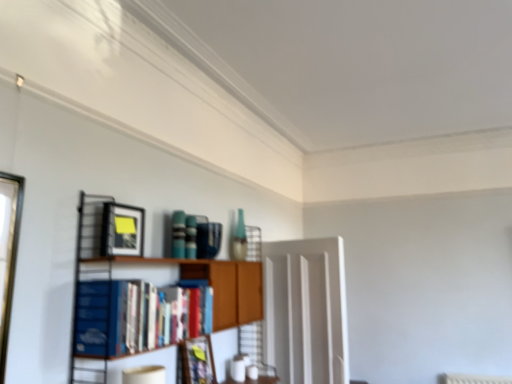
What do you see at coordinates (137, 316) in the screenshot? This screenshot has width=512, height=384. I see `blue hardcover book at left` at bounding box center [137, 316].

Where is `blue hardcover book at left`? The image size is (512, 384). blue hardcover book at left is located at coordinates (137, 316).

Locate an element on the screen. The height and width of the screenshot is (384, 512). wooden bookshelf at center is located at coordinates (148, 299).

Measure the distance between transparent glass door at center and camera.

transparent glass door at center and camera are 2.94 meters apart.

This screenshot has height=384, width=512. Identify the location of blue hardcover book at left. (137, 316).

Which of these two, matte black picture frame at upper left, positioned as the 1th picture frame in left-to-right order, or blue hardcover book at left, stands taller?

With more height is blue hardcover book at left.

Is matte black picture frame at upper left, which is the 2th picture frame from right to left, situated inside blue hardcover book at left or outside?

matte black picture frame at upper left, which is the 2th picture frame from right to left, is not enclosed by blue hardcover book at left.

From the image's perspective, which is above, matte black picture frame at upper left, which is the 2th picture frame from right to left, or blue hardcover book at left?

matte black picture frame at upper left, which is the 2th picture frame from right to left.

Which of these two, matte black picture frame at upper left, marked as the 2th picture frame in a bottom-to-top arrangement, or blue hardcover book at left, is wider?

With larger width is blue hardcover book at left.

Is transparent glass door at center turned away from wooden bookshelf at center?

Yes, transparent glass door at center's orientation is away from wooden bookshelf at center.

Between transparent glass door at center and wooden bookshelf at center, which one is positioned behind?

transparent glass door at center is further from the camera.

Does transparent glass door at center appear on the left side of wooden bookshelf at center?

No.

Between transparent glass door at center and wooden bookshelf at center, which one has larger width?

With larger width is wooden bookshelf at center.

Is blue hardcover book at left wider or thinner than matte black picture frame at center, the first picture frame ordered from the bottom?

In the image, blue hardcover book at left appears to be wider than matte black picture frame at center, the first picture frame ordered from the bottom.

From the picture: Considering the positions of objects blue hardcover book at left and matte black picture frame at center, marked as the first picture frame in a back-to-front arrangement, in the image provided, who is behind, blue hardcover book at left or matte black picture frame at center, marked as the first picture frame in a back-to-front arrangement,?

matte black picture frame at center, marked as the first picture frame in a back-to-front arrangement, is further away from the camera.

Which is more to the left, blue hardcover book at left or matte black picture frame at center, marked as the first picture frame in a back-to-front arrangement?

blue hardcover book at left.

Where is `the 2nd picture frame behind the blue hardcover book at left`? This screenshot has width=512, height=384. the 2nd picture frame behind the blue hardcover book at left is located at coordinates (197, 361).

Is matte black picture frame at center, marked as the first picture frame in a back-to-front arrangement, next to transparent glass door at center?

They are not placed beside each other.

Is matte black picture frame at center, acting as the 2th picture frame starting from the front, positioned with its back to transparent glass door at center?

matte black picture frame at center, acting as the 2th picture frame starting from the front, is not turned away from transparent glass door at center.

Is matte black picture frame at center, marked as the first picture frame in a right-to-left arrangement, inside the boundaries of transparent glass door at center, or outside?

matte black picture frame at center, marked as the first picture frame in a right-to-left arrangement, is outside transparent glass door at center.

Considering the sizes of objects matte black picture frame at center, which appears as the second picture frame when viewed from the top, and transparent glass door at center in the image provided, who is shorter, matte black picture frame at center, which appears as the second picture frame when viewed from the top, or transparent glass door at center?

matte black picture frame at center, which appears as the second picture frame when viewed from the top, is shorter.

Which is more to the left, wooden bookshelf at center or blue hardcover book at left?

blue hardcover book at left is more to the left.

Is wooden bookshelf at center spatially inside blue hardcover book at left, or outside of it?

wooden bookshelf at center is located beyond the bounds of blue hardcover book at left.

Can you confirm if wooden bookshelf at center is wider than blue hardcover book at left?

Correct, the width of wooden bookshelf at center exceeds that of blue hardcover book at left.

Does wooden bookshelf at center lie in front of blue hardcover book at left?

Yes, wooden bookshelf at center is in front of blue hardcover book at left.

Is point (83, 225) closer or farther from the camera than point (198, 359)?

Point (83, 225) is positioned closer to the camera compared to point (198, 359).

Can you confirm if wooden bookshelf at center is bigger than matte black picture frame at center, acting as the 2th picture frame starting from the front?

Yes, wooden bookshelf at center is bigger than matte black picture frame at center, acting as the 2th picture frame starting from the front.

Locate an element on the screen. shelf located above the matte black picture frame at center, acting as the 2th picture frame starting from the front (from the image's perspective) is located at coordinates (148, 299).

Is matte black picture frame at center, marked as the first picture frame in a right-to-left arrangement, located within wooden bookshelf at center?

Yes, matte black picture frame at center, marked as the first picture frame in a right-to-left arrangement, is a part of wooden bookshelf at center.

Is matte black picture frame at upper left, the 1th picture frame when ordered from front to back, aimed at matte black picture frame at center, marked as the first picture frame in a right-to-left arrangement?

No, matte black picture frame at upper left, the 1th picture frame when ordered from front to back, is not oriented towards matte black picture frame at center, marked as the first picture frame in a right-to-left arrangement.

Considering the sizes of matte black picture frame at upper left, the 1th picture frame when ordered from front to back, and matte black picture frame at center, marked as the first picture frame in a back-to-front arrangement, in the image, is matte black picture frame at upper left, the 1th picture frame when ordered from front to back, bigger or smaller than matte black picture frame at center, marked as the first picture frame in a back-to-front arrangement,?

Considering their sizes, matte black picture frame at upper left, the 1th picture frame when ordered from front to back, takes up less space than matte black picture frame at center, marked as the first picture frame in a back-to-front arrangement.

From a real-world perspective, which is physically below, matte black picture frame at upper left, which appears as the 2th picture frame when viewed from the back, or matte black picture frame at center, marked as the first picture frame in a back-to-front arrangement?

In real-world perspective, matte black picture frame at center, marked as the first picture frame in a back-to-front arrangement, is lower.

Locate an element on the screen. Image resolution: width=512 pixels, height=384 pixels. book that is under the matte black picture frame at upper left, the 1th picture frame when ordered from front to back (from a real-world perspective) is located at coordinates pos(137,316).

Image resolution: width=512 pixels, height=384 pixels. In order to click on glass door to the right of wooden bookshelf at center in this screenshot , I will do `click(306, 310)`.

Looking at the image, which one is located further to matte black picture frame at center, marked as the first picture frame in a back-to-front arrangement, wooden bookshelf at center or transparent glass door at center?

transparent glass door at center is positioned further to the anchor matte black picture frame at center, marked as the first picture frame in a back-to-front arrangement.

Looking at the image, which one is located closer to wooden bookshelf at center, matte black picture frame at upper left, the first picture frame in the top-to-bottom sequence, or matte black picture frame at center, marked as the first picture frame in a back-to-front arrangement?

matte black picture frame at upper left, the first picture frame in the top-to-bottom sequence, is positioned closer to the anchor wooden bookshelf at center.

Which object lies nearer to the anchor point matte black picture frame at center, arranged as the second picture frame when viewed from the left, matte black picture frame at upper left, which appears as the 2th picture frame when viewed from the back, or blue hardcover book at left?

Among the two, blue hardcover book at left is located nearer to matte black picture frame at center, arranged as the second picture frame when viewed from the left.

Estimate the real-world distances between objects in this image. Which object is further from matte black picture frame at upper left, which appears as the 2th picture frame when viewed from the back, wooden bookshelf at center or matte black picture frame at center, which appears as the second picture frame when viewed from the top?

Based on the image, matte black picture frame at center, which appears as the second picture frame when viewed from the top, appears to be further to matte black picture frame at upper left, which appears as the 2th picture frame when viewed from the back.

Estimate the real-world distances between objects in this image. Which object is further from blue hardcover book at left, matte black picture frame at center, acting as the 2th picture frame starting from the front, or matte black picture frame at upper left, the first picture frame in the top-to-bottom sequence?

matte black picture frame at center, acting as the 2th picture frame starting from the front, is positioned further to the anchor blue hardcover book at left.

Which object lies further to the anchor point wooden bookshelf at center, transparent glass door at center or matte black picture frame at upper left, the first picture frame in the top-to-bottom sequence?

The object further to wooden bookshelf at center is transparent glass door at center.

Looking at the image, which one is located further to matte black picture frame at center, the first picture frame ordered from the bottom, wooden bookshelf at center or blue hardcover book at left?

Based on the image, blue hardcover book at left appears to be further to matte black picture frame at center, the first picture frame ordered from the bottom.

Considering their positions, is transparent glass door at center positioned further to blue hardcover book at left than wooden bookshelf at center?

transparent glass door at center.

At what (x,y) coordinates should I click in order to perform the action: click on book between matte black picture frame at upper left, which is the 2th picture frame from right to left, and matte black picture frame at center, arranged as the second picture frame when viewed from the left, from top to bottom. Please return your answer as a coordinate pair (x, y). Looking at the image, I should click on (137, 316).

Locate an element on the screen. The width and height of the screenshot is (512, 384). book between wooden bookshelf at center and transparent glass door at center in the front-back direction is located at coordinates (137, 316).

I want to click on shelf between matte black picture frame at upper left, the first picture frame in the top-to-bottom sequence, and matte black picture frame at center, which appears as the second picture frame when viewed from the top, from top to bottom, so click(148, 299).

Where is `picture frame between matte black picture frame at upper left, the 1th picture frame when ordered from front to back, and transparent glass door at center from left to right`? picture frame between matte black picture frame at upper left, the 1th picture frame when ordered from front to back, and transparent glass door at center from left to right is located at coordinates (197, 361).